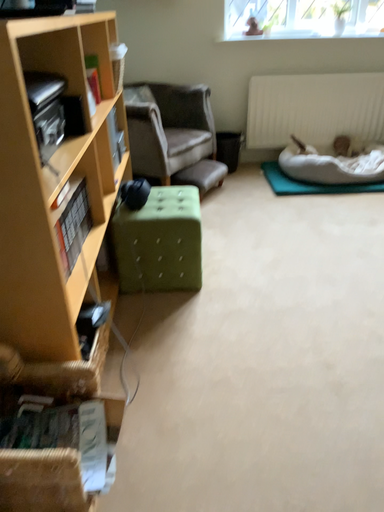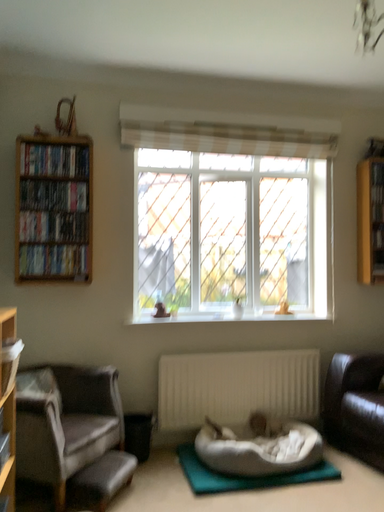
Question: Which way did the camera rotate in the video?

Choices:
 (A) rotated downward
 (B) rotated upward

Answer: (B)